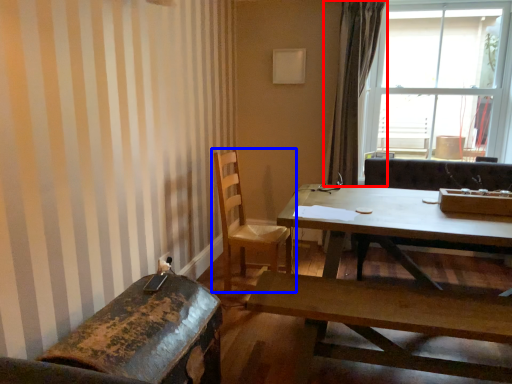
Question: Which object appears farthest to the camera in this image, curtain (highlighted by a red box) or chair (highlighted by a blue box)?

Choices:
 (A) curtain
 (B) chair

Answer: (A)